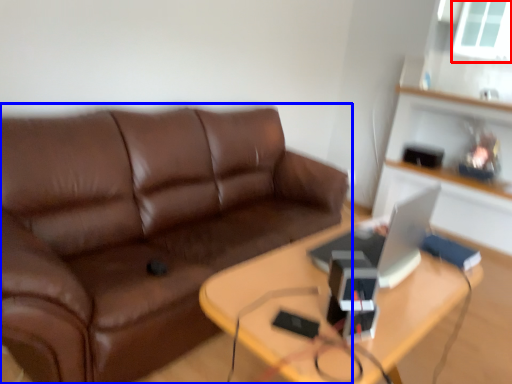
Question: Which of the following is the farthest to the observer, window screen (highlighted by a red box) or studio couch (highlighted by a blue box)?

Choices:
 (A) window screen
 (B) studio couch

Answer: (A)